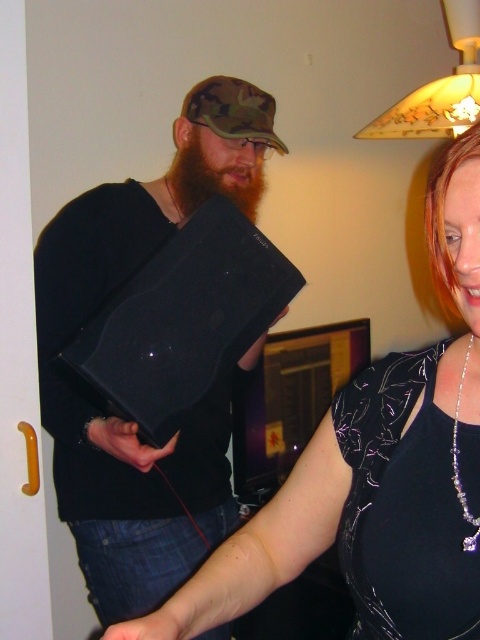
Question: Which object is the farthest from the blonde shiny hair at upper right?

Choices:
 (A) silver metallic necklace at upper right
 (B) brownwoollybeard at center
 (C) shiny black dress at center
 (D) matte black laptop at left

Answer: (D)

Question: Based on their relative distances, which object is nearer to the silver metallic necklace at upper right?

Choices:
 (A) blonde shiny hair at upper right
 (B) matte black laptop at left
 (C) brownwoollybeard at center
 (D) shiny black dress at center

Answer: (D)

Question: Can you confirm if blonde shiny hair at upper right is smaller than silver metallic necklace at upper right?

Choices:
 (A) yes
 (B) no

Answer: (B)

Question: Does shiny black dress at center appear under matte black laptop at left?

Choices:
 (A) no
 (B) yes

Answer: (B)

Question: Observing the image, what is the correct spatial positioning of shiny black dress at center in reference to silver metallic necklace at upper right?

Choices:
 (A) left
 (B) right

Answer: (A)

Question: Which object appears closest to the camera in this image?

Choices:
 (A) blonde shiny hair at upper right
 (B) silver metallic necklace at upper right

Answer: (A)